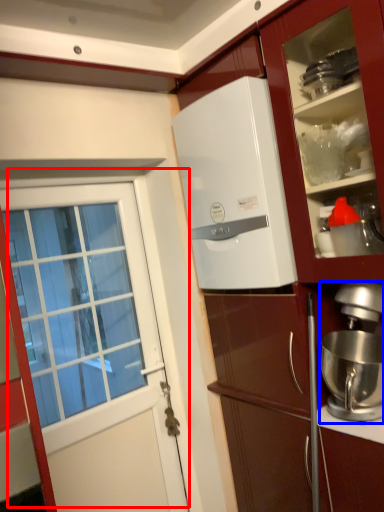
Question: Which object appears farthest to the camera in this image, door (highlighted by a red box) or kitchen appliance (highlighted by a blue box)?

Choices:
 (A) door
 (B) kitchen appliance

Answer: (A)